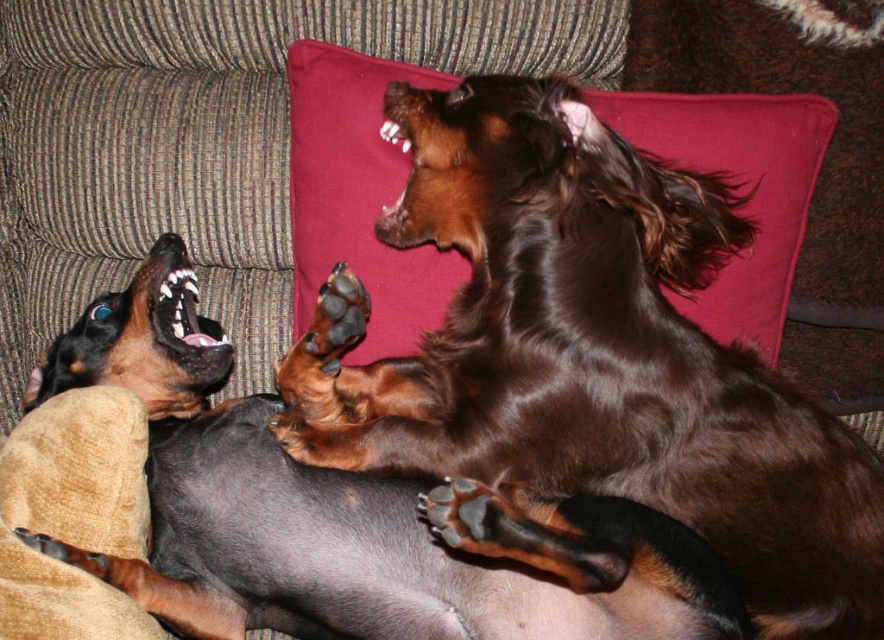
In the scene shown: You are a dog owner who wants to place a new velvet cushion at upper center on the couch where the brown furry dog at upper right is currently lying. Based on their sizes, will the cushion fit under the dog without being crushed?

The velvet cushion at upper center is not as tall as brown furry dog at upper right, so it should fit under the dog without being crushed.

You are a photographer positioned at the origin point. You want to take a photo of the black glossy dog at center. Given that the camera has a focal length of 50mm and the dog is at coordinates point 0.806, 0.398, will the dog be in the frame if the camera is set to a 35mm lens?

The black glossy dog at center is located at point (x=351, y=515). Since the camera is set to a 35mm lens, which has a wider field of view than a 50mm lens, the dog will likely be within the frame as long as the photographer adjusts the angle appropriately.